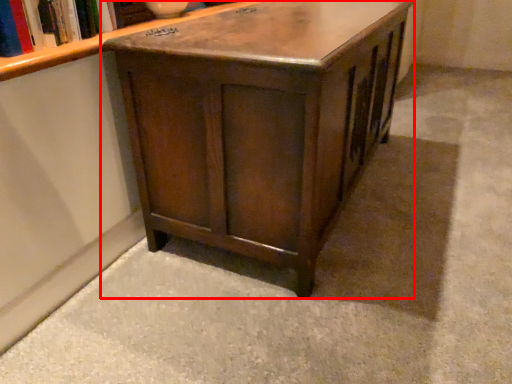
Question: From the image's perspective, where is table (annotated by the red box) located in relation to book in the image?

Choices:
 (A) below
 (B) above

Answer: (A)